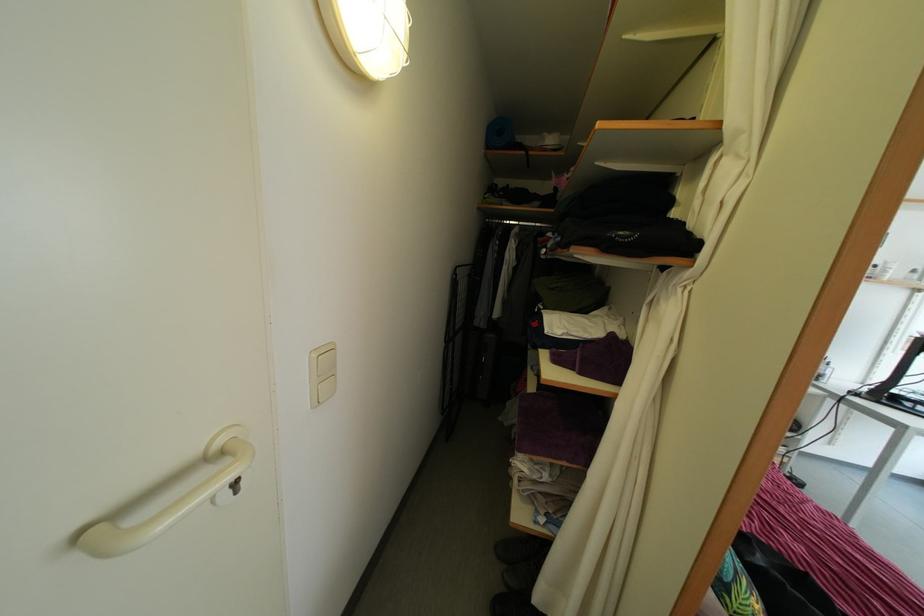
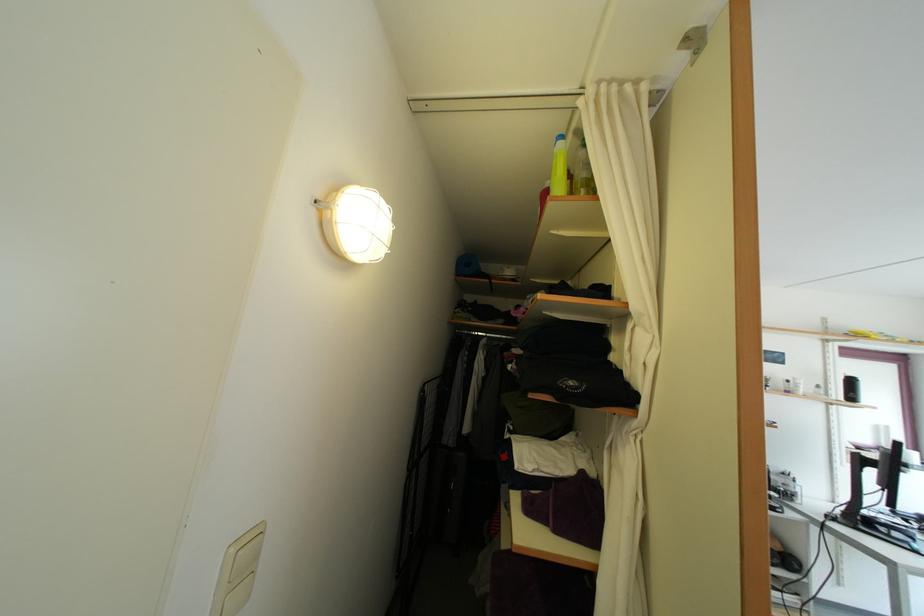
Locate, in the second image, the point that corresponds to pixel 623 403 in the first image.

(602, 576)